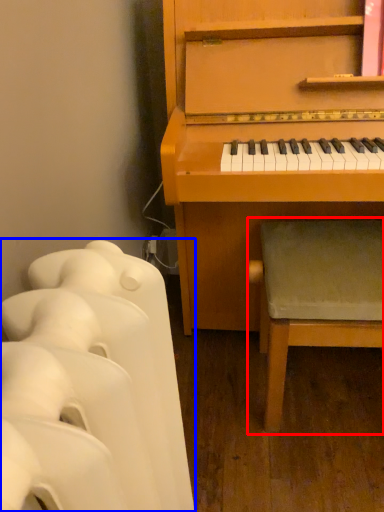
Question: Which point is closer to the camera, music stool (highlighted by a red box) or furniture (highlighted by a blue box)?

Choices:
 (A) music stool
 (B) furniture

Answer: (B)